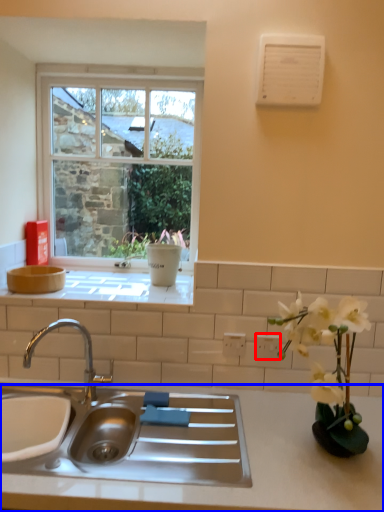
Question: Which object appears closest to the camera in this image, electric outlet (highlighted by a red box) or countertop (highlighted by a blue box)?

Choices:
 (A) electric outlet
 (B) countertop

Answer: (B)